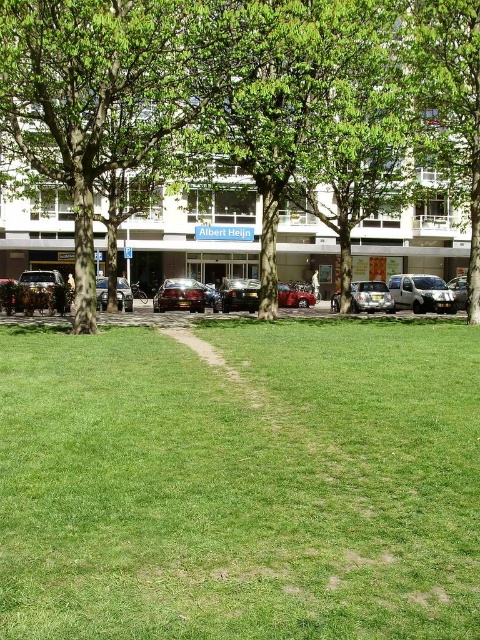
You are a delivery driver who needs to park your metallic silver van at center in the parking lot behind the green leafy tree at center. The parking lot is 40 feet wide. Can you safely park your van there?

The distance between the green leafy tree at center and the metallic silver van at center is 36.45 feet. Since the parking lot is 40 feet wide, there is enough space to safely park the metallic silver van at center behind the tree.

You are a pedestrian standing at the start of the path in the park. You want to walk to the metallic silver van at center. Is the green leafy tree at center blocking your path?

The green leafy tree at center is closer to the viewer than the metallic silver van at center, so the tree is in front of the van. This means the tree is blocking the path to the van.